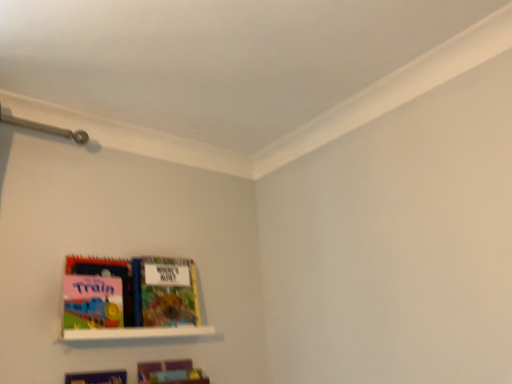
Question: From the image's perspective, would you say white glossy shelf at lower left is shown under matte plastic book at lower left, marked as the 1th book in a bottom-to-top arrangement?

Choices:
 (A) no
 (B) yes

Answer: (A)

Question: Does white glossy shelf at lower left touch matte plastic book at lower left, marked as the 1th book in a bottom-to-top arrangement?

Choices:
 (A) yes
 (B) no

Answer: (B)

Question: Is matte plastic book at lower left, placed as the 2th book when sorted from top to bottom, a part of white glossy shelf at lower left?

Choices:
 (A) yes
 (B) no

Answer: (B)

Question: From a real-world perspective, is white glossy shelf at lower left below matte plastic book at lower left, marked as the 1th book in a bottom-to-top arrangement?

Choices:
 (A) yes
 (B) no

Answer: (B)

Question: Is matte plastic book at lower left, marked as the 1th book in a bottom-to-top arrangement, at the back of white glossy shelf at lower left?

Choices:
 (A) no
 (B) yes

Answer: (A)

Question: From a real-world perspective, is matte plastic book at lower left, marked as the 1th book in a bottom-to-top arrangement, above or below multicolored paper book at center, which appears as the first book when viewed from the top?

Choices:
 (A) above
 (B) below

Answer: (B)

Question: Considering the positions of matte plastic book at lower left, placed as the 2th book when sorted from top to bottom, and multicolored paper book at center, which appears as the first book when viewed from the top, in the image, is matte plastic book at lower left, placed as the 2th book when sorted from top to bottom, wider or thinner than multicolored paper book at center, which appears as the first book when viewed from the top,?

Choices:
 (A) wide
 (B) thin

Answer: (B)

Question: Considering the positions of matte plastic book at lower left, placed as the 2th book when sorted from top to bottom, and multicolored paper book at center, marked as the second book in a bottom-to-top arrangement, in the image, is matte plastic book at lower left, placed as the 2th book when sorted from top to bottom, taller or shorter than multicolored paper book at center, marked as the second book in a bottom-to-top arrangement,?

Choices:
 (A) short
 (B) tall

Answer: (A)

Question: Considering the positions of point (146, 367) and point (174, 301), is point (146, 367) closer or farther from the camera than point (174, 301)?

Choices:
 (A) farther
 (B) closer

Answer: (B)

Question: From a real-world perspective, is multicolored paper book at center, which appears as the first book when viewed from the top, above or below white glossy shelf at lower left?

Choices:
 (A) above
 (B) below

Answer: (A)

Question: Which is correct: multicolored paper book at center, marked as the second book in a bottom-to-top arrangement, is inside white glossy shelf at lower left, or outside of it?

Choices:
 (A) inside
 (B) outside

Answer: (B)

Question: Considering the positions of point (145, 288) and point (123, 334), is point (145, 288) closer or farther from the camera than point (123, 334)?

Choices:
 (A) farther
 (B) closer

Answer: (A)

Question: In terms of size, does multicolored paper book at center, marked as the second book in a bottom-to-top arrangement, appear bigger or smaller than white glossy shelf at lower left?

Choices:
 (A) big
 (B) small

Answer: (A)

Question: Considering the positions of white glossy shelf at lower left and matte plastic book at lower left, marked as the 1th book in a bottom-to-top arrangement, in the image, is white glossy shelf at lower left wider or thinner than matte plastic book at lower left, marked as the 1th book in a bottom-to-top arrangement,?

Choices:
 (A) wide
 (B) thin

Answer: (A)

Question: From the image's perspective, relative to matte plastic book at lower left, marked as the 1th book in a bottom-to-top arrangement, is white glossy shelf at lower left above or below?

Choices:
 (A) below
 (B) above

Answer: (B)